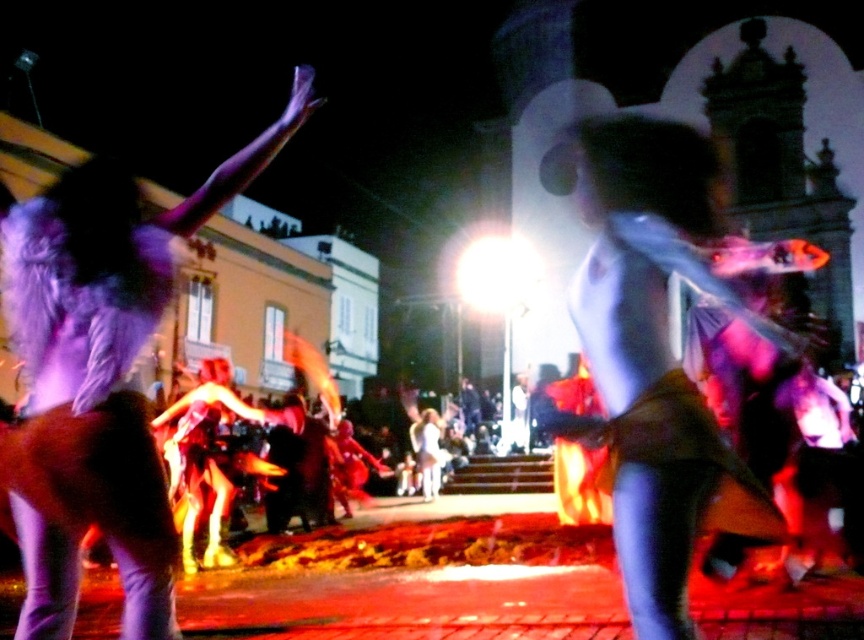
You are a photographer at the event. You want to capture a photo where both the matte white dress at center and the purple feathered wings at upper left are clearly visible. Since the camera has a limited focus range, which object should you prioritize focusing on to ensure it appears sharp given their sizes?

The matte white dress at center is smaller than the purple feathered wings at upper left. To ensure both are sharp, prioritize focusing on the smaller matte white dress at center because smaller objects often require precise focus to capture details clearly.

You are a photographer at the event and want to capture a clear photo of the matte white dress at center without the purple feathered wings at upper left appearing in the background. Is this possible given their positions?

The matte white dress at center is positioned over the purple feathered wings at upper left, so the wings will appear behind the dress in the photo. To avoid the wings in the background, you would need to adjust the angle or move the dress so it is no longer overlapping with the wings.

You are a photographer standing at the center of the town square. You want to capture a photo of the matte white dress at center. Where should you aim your camera to ensure the dress is in the frame?

You should aim your camera at the point with coordinates 0.545 on the horizontal axis and 0.759 on the vertical axis to capture the matte white dress at center.